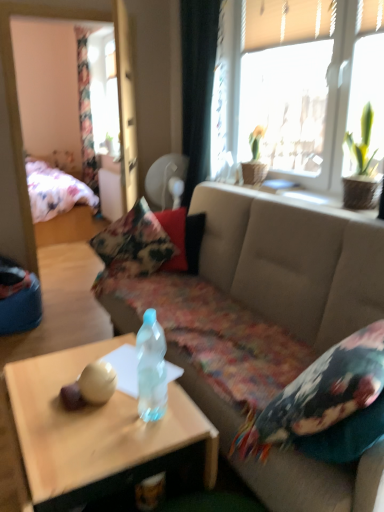
Identify the location of vacant area to the left of translucent plastic bottle at center. Image resolution: width=384 pixels, height=512 pixels. (102, 424).